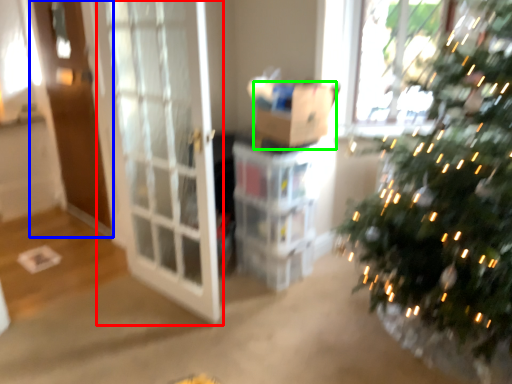
Question: Considering the real-world distances, which object is farthest from screen door (highlighted by a red box)? screen door (highlighted by a blue box) or cardboard box (highlighted by a green box)?

Choices:
 (A) screen door
 (B) cardboard box

Answer: (A)